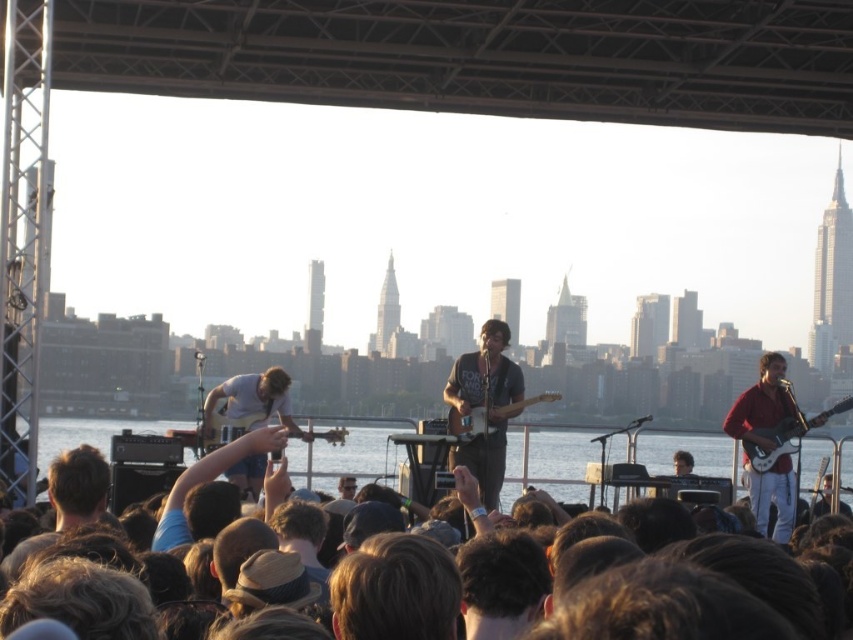
You are a photographer at the outdoor concert. You want to capture a photo of the clear water at stage center and the white glossy electric guitar at right. Based on their positions, which object should you focus on first if you are moving from left to right across the stage?

The clear water at stage center should be focused on first because it is positioned to the left of the white glossy electric guitar at right when moving from left to right.

Based on the photo, you are a photographer at the concert and want to capture both the white glossy electric guitar at right and the wooden electric guitar at center in a single frame. Given their sizes, which guitar will appear wider in the photo?

The white glossy electric guitar at right will appear wider in the photo since its width surpasses that of the wooden electric guitar at center.

You are standing at the front of the stage during the outdoor concert. You see two points in the image, one at point coordinates point [820,438] and another at point coordinates point [341,483]. Which point is closer to you?

Point [341,483] is closer to you because it is less far away than point [820,438] which is further away from the camera.